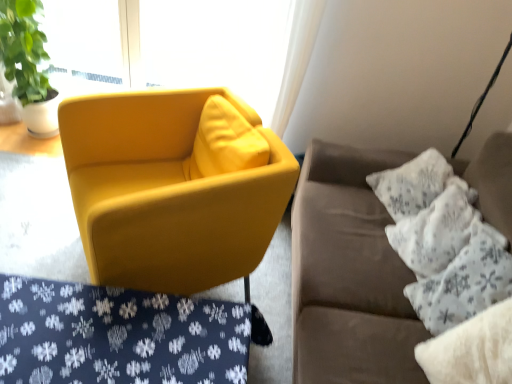
Locate an element on the screen. free space above velvet yellow armchair at center (from a real-world perspective) is located at coordinates (119, 327).